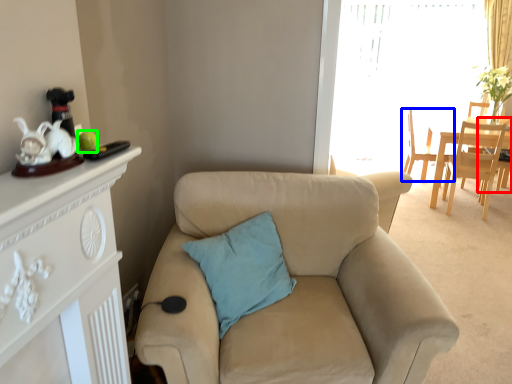
Question: Based on their relative distances, which object is farther from armchair (highlighted by a red box)? Choose from chair (highlighted by a blue box) and teal (highlighted by a green box).

Choices:
 (A) chair
 (B) teal

Answer: (B)